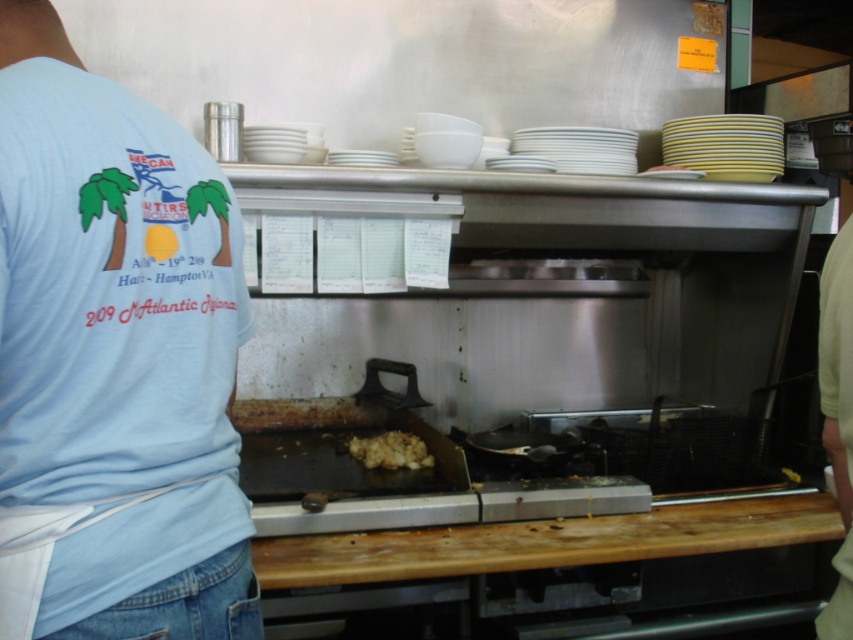
Between light blue fabric shirt at upper left and brown crumbly food at center, which one appears on the right side from the viewer's perspective?

Positioned to the right is brown crumbly food at center.

Does point (161, 362) come behind point (395, 433)?

No, it is not.

The image size is (853, 640). In order to click on light blue fabric shirt at upper left in this screenshot , I will do `click(113, 358)`.